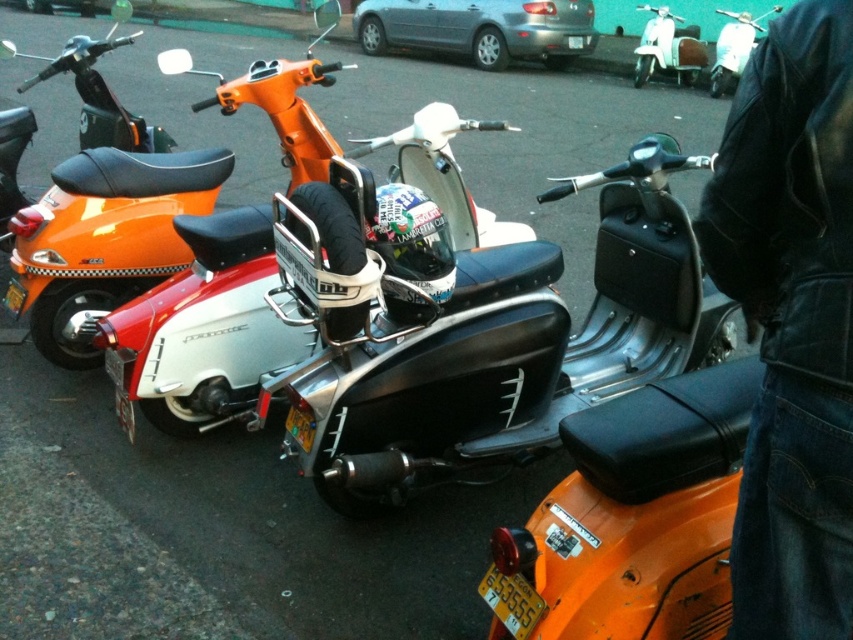
You are standing in front of the row of vintage scooters and want to take a photo. You notice two points marked in the image. The first point is at coordinate point [523,614] and the second is at coordinate point [723,65]. Which point is closer to you when you are facing the scooters?

Point [523,614] is closer to the camera than point [723,65], so the first point is closer to you.